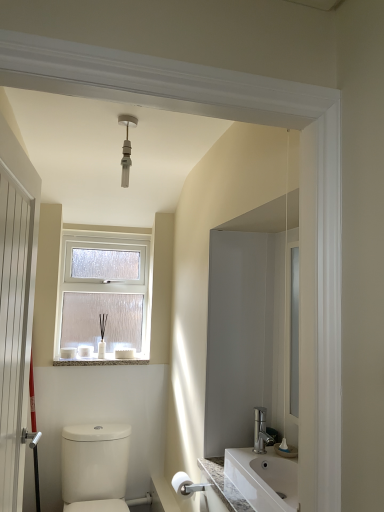
Question: Based on their positions, is white glossy toilet at lower left located to the left or right of white plastic light fixture at upper center?

Choices:
 (A) left
 (B) right

Answer: (A)

Question: Choose the correct answer: Is white glossy toilet at lower left inside white plastic light fixture at upper center or outside it?

Choices:
 (A) outside
 (B) inside

Answer: (A)

Question: Estimate the real-world distances between objects in this image. Which object is farther from the white glossy toiletries at window?

Choices:
 (A) white wooden door at left
 (B) white marble window sill at lower center
 (C) white frosted glass window at upper center
 (D) white glossy toilet at lower left
 (E) white matte toilet paper at lower center

Answer: (A)

Question: Based on their relative distances, which object is farther from the white glossy toiletries at window?

Choices:
 (A) white plastic light fixture at upper center
 (B) white frosted glass window at upper center
 (C) white marble window sill at lower center
 (D) white glossy toilet at lower left
 (E) white wooden door at left

Answer: (E)